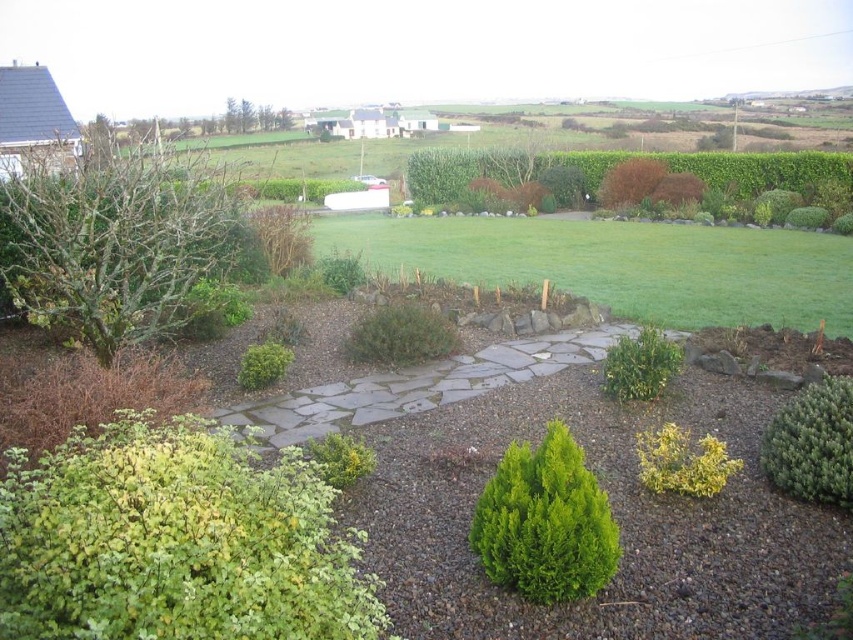
Can you confirm if green textured shrub at lower right is wider than green leafy shrub at center-right?

Yes.

Does point (764, 426) come behind point (639, 330)?

No, (764, 426) is in front of (639, 330).

This screenshot has width=853, height=640. In order to click on green textured shrub at lower right in this screenshot , I will do tap(811, 444).

Who is taller, bare branches at left or gray stone path at center?

Standing taller between the two is bare branches at left.

The image size is (853, 640). Describe the element at coordinates (115, 244) in the screenshot. I see `bare branches at left` at that location.

Locate an element on the screen. The image size is (853, 640). bare branches at left is located at coordinates (115, 244).

Who is positioned more to the right, green leafy shrub at lower left or green textured shrub at lower right?

green textured shrub at lower right

Is green leafy shrub at lower left to the left of green textured shrub at lower right from the viewer's perspective?

Correct, you'll find green leafy shrub at lower left to the left of green textured shrub at lower right.

Which is in front, point (119, 529) or point (840, 376)?

Point (119, 529) is more forward.

Find the location of `green leafy shrub at lower left`. green leafy shrub at lower left is located at coordinates (177, 540).